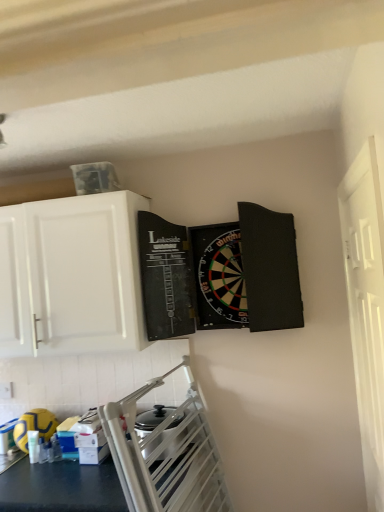
Question: Is white glossy cabinet at upper left inside the boundaries of yellow rubber ball at lower left, or outside?

Choices:
 (A) inside
 (B) outside

Answer: (B)

Question: Based on their sizes in the image, would you say white glossy cabinet at upper left is bigger or smaller than yellow rubber ball at lower left?

Choices:
 (A) big
 (B) small

Answer: (A)

Question: Which object is the closest to the yellow rubber ball at lower left?

Choices:
 (A) white glossy cabinet at upper left
 (B) white wooden door at right

Answer: (A)

Question: Which is nearer to the white glossy cabinet at upper left?

Choices:
 (A) yellow rubber ball at lower left
 (B) white wooden door at right

Answer: (A)